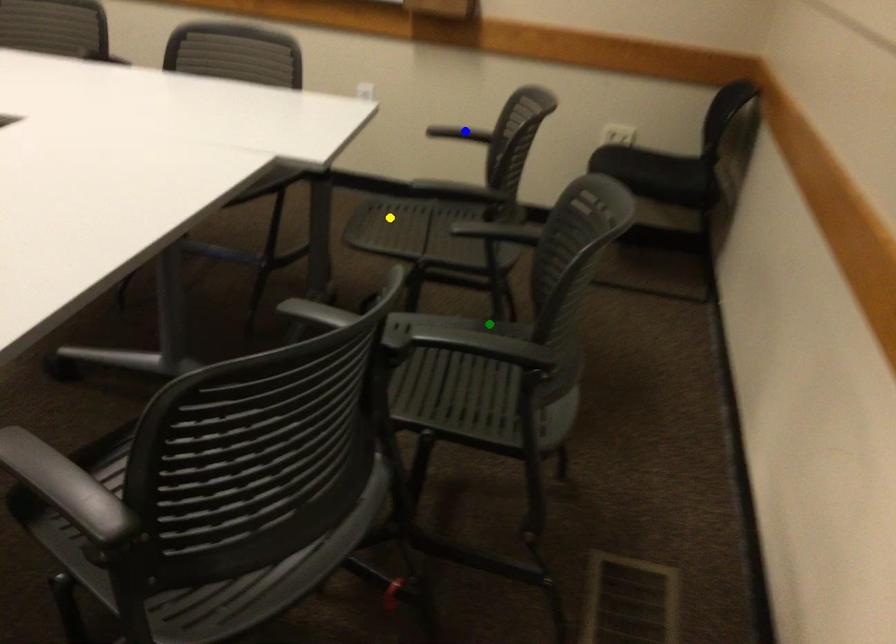
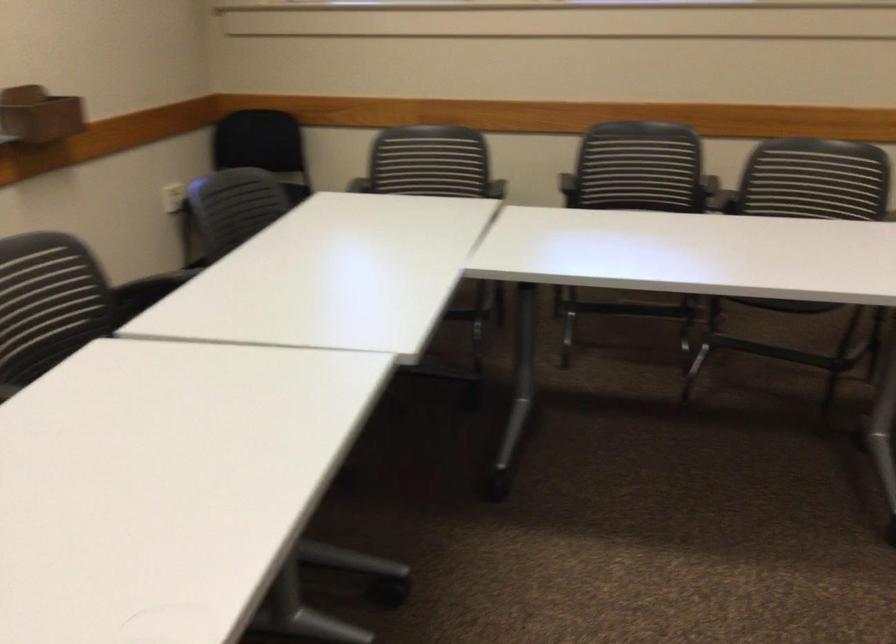
I am providing you with two images of the same scene from different viewpoints. Three points are marked in image1. Which point corresponds to a part or object that is occluded in image2?In image1, three points are marked. Which of them correspond to a part or object that is occluded in image2?Among the three points shown in image1, which one corresponds to a part or object that is no longer visible due to occlusion in image2?

yellow point, blue point, green point cannot be seen in image2.